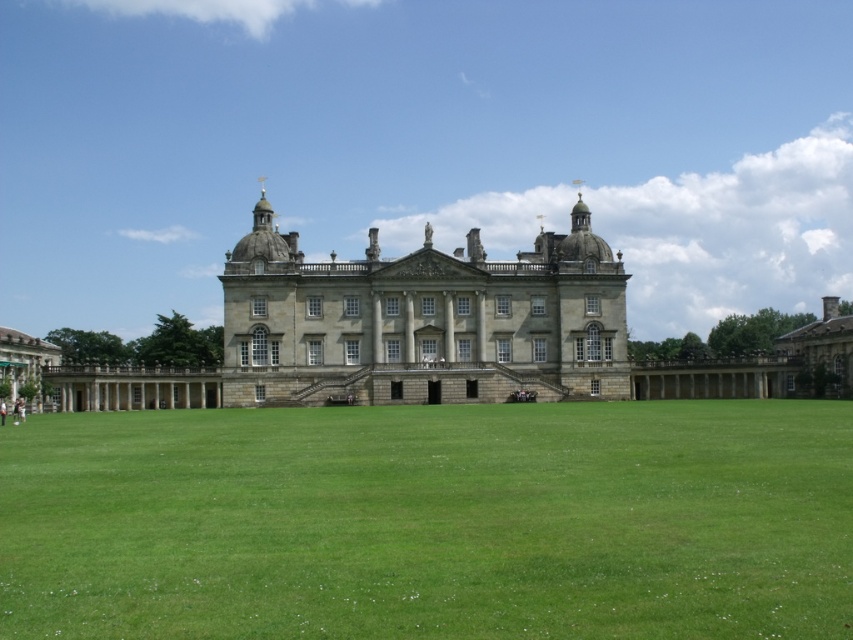
Question: Which object appears farthest from the camera in this image?

Choices:
 (A) green grass at center
 (B) stone gray palace at center

Answer: (B)

Question: Can you confirm if green grass at center is positioned to the left of stone gray palace at center?

Choices:
 (A) no
 (B) yes

Answer: (A)

Question: Can you confirm if green grass at center is wider than stone gray palace at center?

Choices:
 (A) no
 (B) yes

Answer: (B)

Question: Which point is closer to the camera?

Choices:
 (A) green grass at center
 (B) stone gray palace at center

Answer: (A)

Question: Is green grass at center below stone gray palace at center?

Choices:
 (A) no
 (B) yes

Answer: (B)

Question: Among these objects, which one is nearest to the camera?

Choices:
 (A) green grass at center
 (B) stone gray palace at center

Answer: (A)